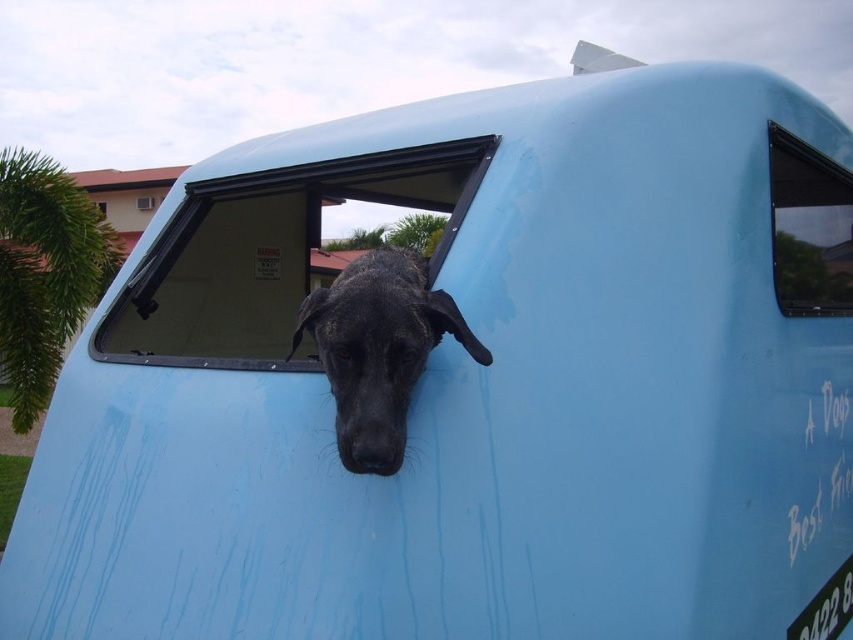
You are a delivery driver who needs to check if the black matte dog at center can fit through the transparent glass window at upper center. Based on the scene description, can the dog pass through the window?

The black matte dog at center is larger in size than the transparent glass window at upper center, so the dog cannot pass through the window.

You are a delivery robot with a 2.5 feet wide package. You need to place it through the transparent plastic window at center to reach the black matte dog at center. Can the package fit through the space between them?

The distance between the transparent plastic window at center and black matte dog at center is 3.31 feet. Since the package is 2.5 feet wide, it can fit through the space between them as the distance is wider than the package.

In the scene shown: You are a delivery robot trying to locate the transparent glass window at upper center on the light blue vehicle. According to the coordinates provided, where exactly is this window positioned?

The transparent glass window at upper center is located at point 0.317 on the x axis and 0.171 on the y axis.